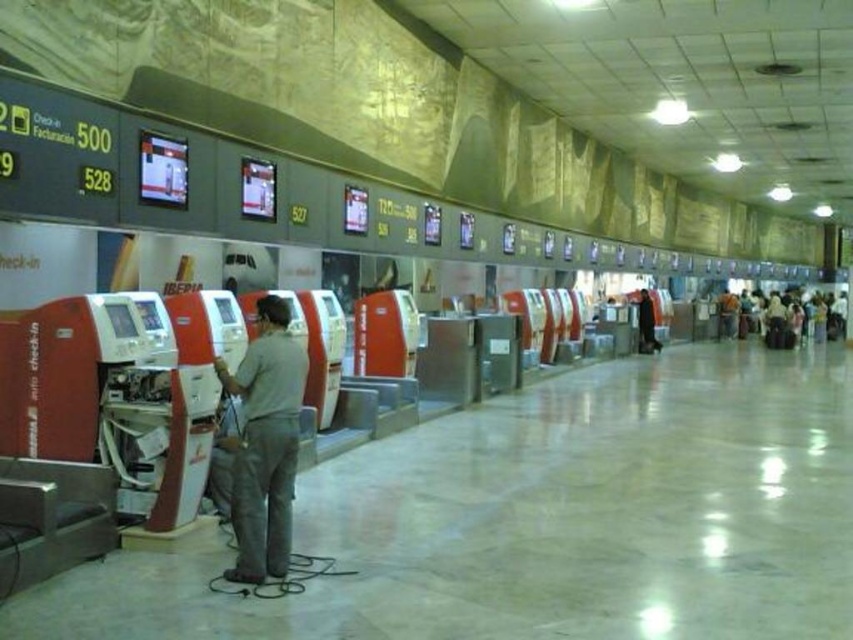
Is light brown fabric bag at right shorter than dark fabric coat at center?

No.

Does light brown fabric bag at right have a greater height compared to dark fabric coat at center?

Correct, light brown fabric bag at right is much taller as dark fabric coat at center.

Which is behind, point (780, 301) or point (641, 326)?

Point (780, 301)

Locate an element on the screen. This screenshot has height=640, width=853. light brown fabric bag at right is located at coordinates (792, 321).

Between gray fabric shirt at center and dark fabric coat at center, which one is positioned higher?

Positioned higher is dark fabric coat at center.

What do you see at coordinates (265, 442) in the screenshot? I see `gray fabric shirt at center` at bounding box center [265, 442].

Is point (242, 560) in front of point (648, 323)?

Yes.

This screenshot has height=640, width=853. What are the coordinates of `gray fabric shirt at center` in the screenshot? It's located at (265, 442).

Is gray fabric shirt at center wider than light brown fabric bag at right?

In fact, gray fabric shirt at center might be narrower than light brown fabric bag at right.

Can you confirm if gray fabric shirt at center is positioned above light brown fabric bag at right?

Incorrect, gray fabric shirt at center is not positioned above light brown fabric bag at right.

Is point (276, 516) positioned after point (817, 337)?

That is False.

Identify the location of gray fabric shirt at center. This screenshot has height=640, width=853. (265, 442).